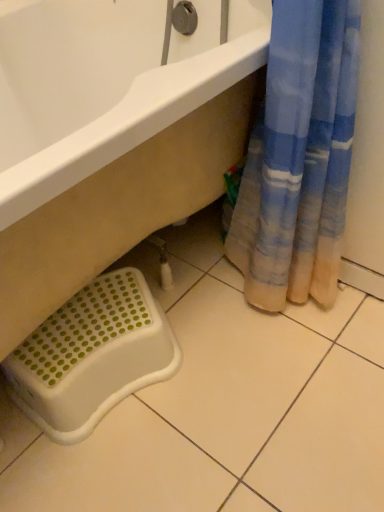
Question: From a real-world perspective, is white plastic step stool at lower left physically above white plastic bathtub at lower left?

Choices:
 (A) no
 (B) yes

Answer: (A)

Question: From the image's perspective, is white plastic step stool at lower left located beneath white plastic bathtub at lower left?

Choices:
 (A) no
 (B) yes

Answer: (B)

Question: Would you say white plastic step stool at lower left is a long distance from white plastic bathtub at lower left?

Choices:
 (A) no
 (B) yes

Answer: (A)

Question: Is white plastic step stool at lower left oriented away from white plastic bathtub at lower left?

Choices:
 (A) no
 (B) yes

Answer: (B)

Question: From a real-world perspective, is white plastic step stool at lower left located beneath white plastic bathtub at lower left?

Choices:
 (A) no
 (B) yes

Answer: (B)

Question: Could you tell me if white plastic step stool at lower left is turned towards white plastic bathtub at lower left?

Choices:
 (A) no
 (B) yes

Answer: (B)

Question: Does white plastic bathtub at lower left have a greater height compared to white plastic step stool at lower left?

Choices:
 (A) no
 (B) yes

Answer: (B)

Question: Is white plastic bathtub at lower left shorter than white plastic step stool at lower left?

Choices:
 (A) yes
 (B) no

Answer: (B)

Question: Are white plastic bathtub at lower left and white plastic step stool at lower left making contact?

Choices:
 (A) no
 (B) yes

Answer: (A)

Question: Can you confirm if white plastic bathtub at lower left is bigger than white plastic step stool at lower left?

Choices:
 (A) yes
 (B) no

Answer: (A)

Question: Can you confirm if white plastic bathtub at lower left is smaller than white plastic step stool at lower left?

Choices:
 (A) no
 (B) yes

Answer: (A)

Question: Could you tell me if white plastic bathtub at lower left is facing white plastic step stool at lower left?

Choices:
 (A) no
 (B) yes

Answer: (B)

Question: Choose the correct answer: Is white plastic bathtub at lower left inside white plastic step stool at lower left or outside it?

Choices:
 (A) outside
 (B) inside

Answer: (A)